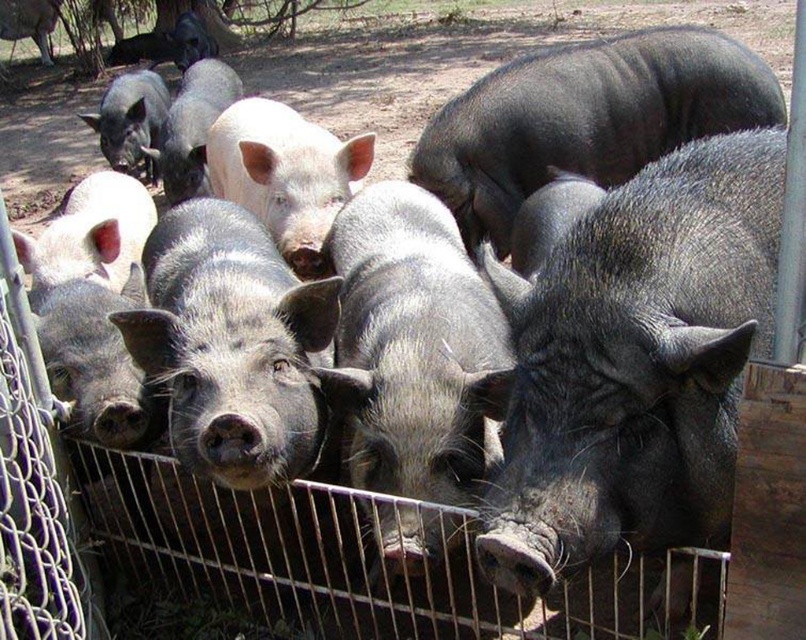
Question: Can you confirm if gray matte pig at center is positioned to the left of shiny black pig at center?

Choices:
 (A) yes
 (B) no

Answer: (A)

Question: Which of the following is the closest to the observer?

Choices:
 (A) gray textured pig at center
 (B) shiny black pig at center
 (C) gray matte pig at center

Answer: (A)

Question: Which point is farther to the camera?

Choices:
 (A) (499, 285)
 (B) (688, 61)

Answer: (B)

Question: Does gray textured pig at center come behind shiny black pig at center?

Choices:
 (A) no
 (B) yes

Answer: (A)

Question: Which object appears farthest from the camera in this image?

Choices:
 (A) shiny black pig at center
 (B) gray matte pig at center

Answer: (A)

Question: Is gray textured pig at center closer to the viewer compared to shiny black pig at center?

Choices:
 (A) yes
 (B) no

Answer: (A)